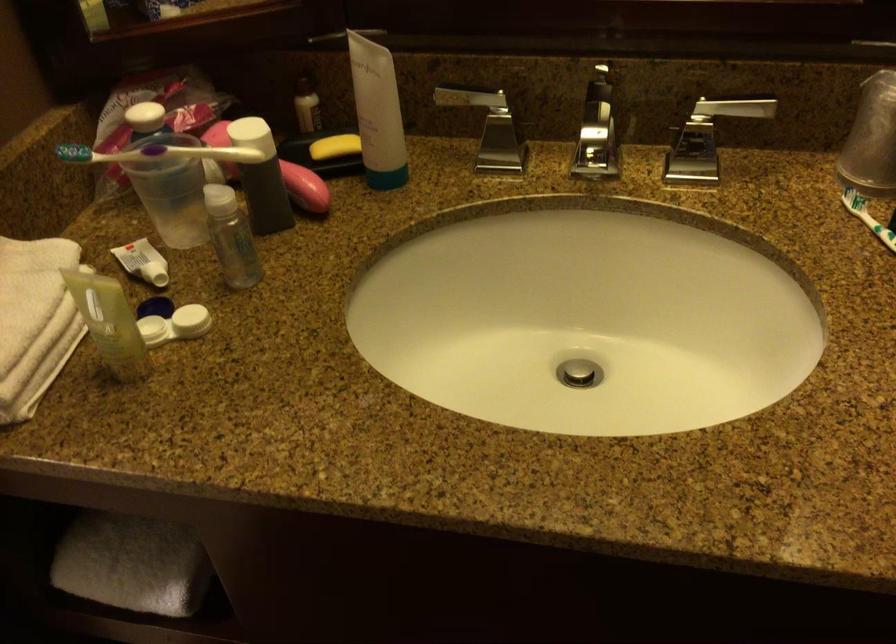
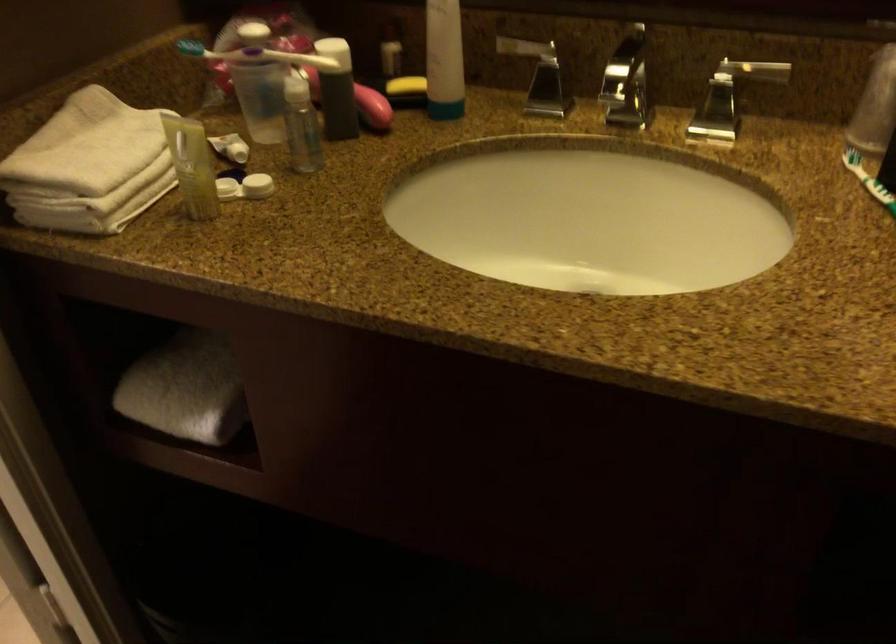
In the second image, find the point that corresponds to [176,325] in the first image.

(245, 187)